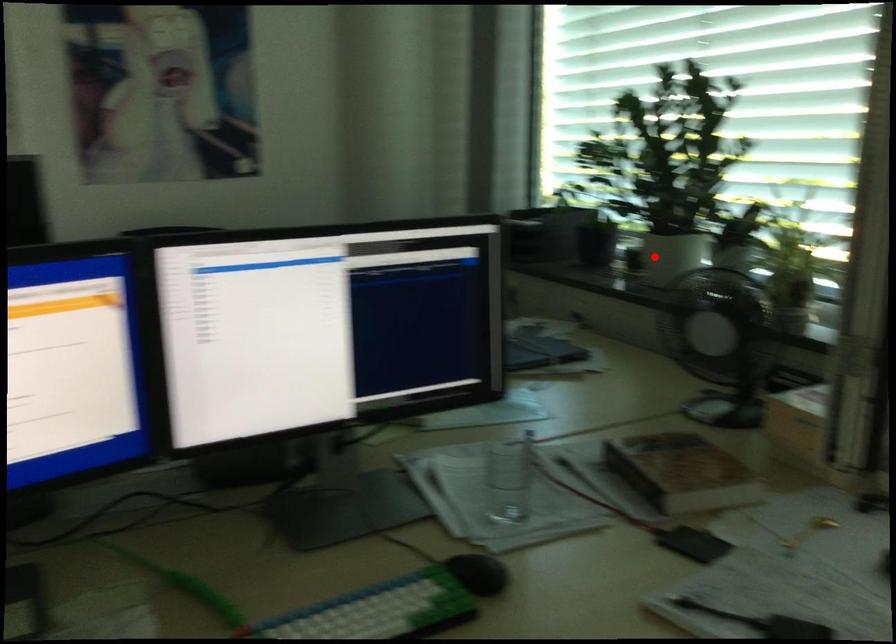
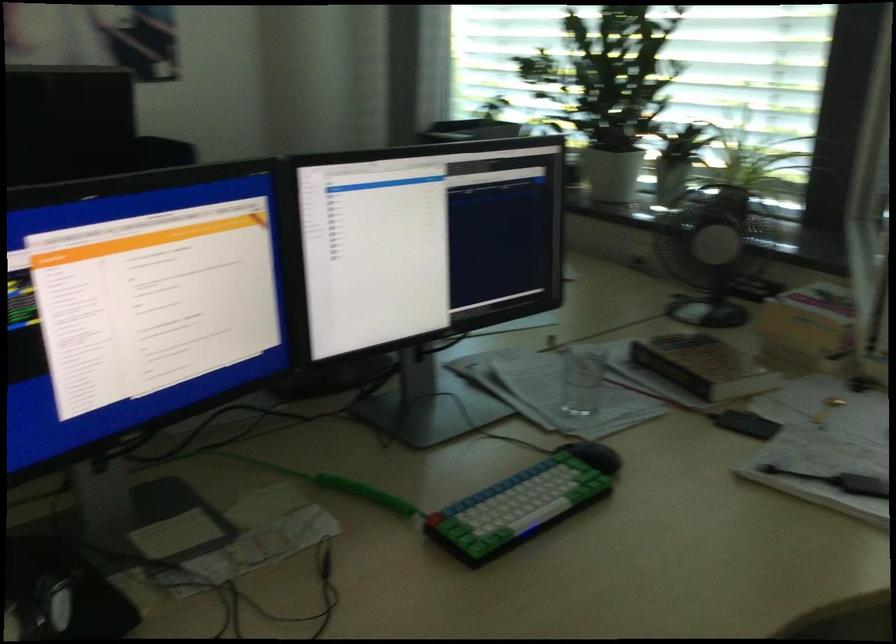
Find the pixel in the second image that matches the highlighted location in the first image.

(612, 174)